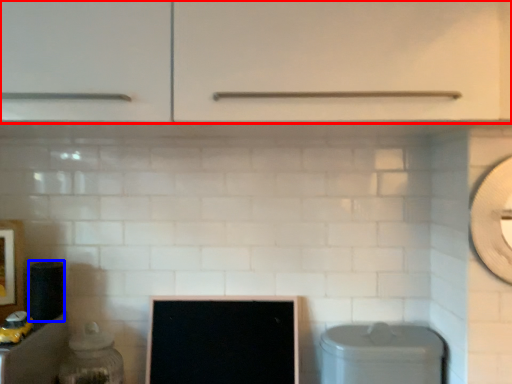
Question: Which of the following is the closest to the observer, cabinetry (highlighted by a red box) or appliance (highlighted by a blue box)?

Choices:
 (A) cabinetry
 (B) appliance

Answer: (A)